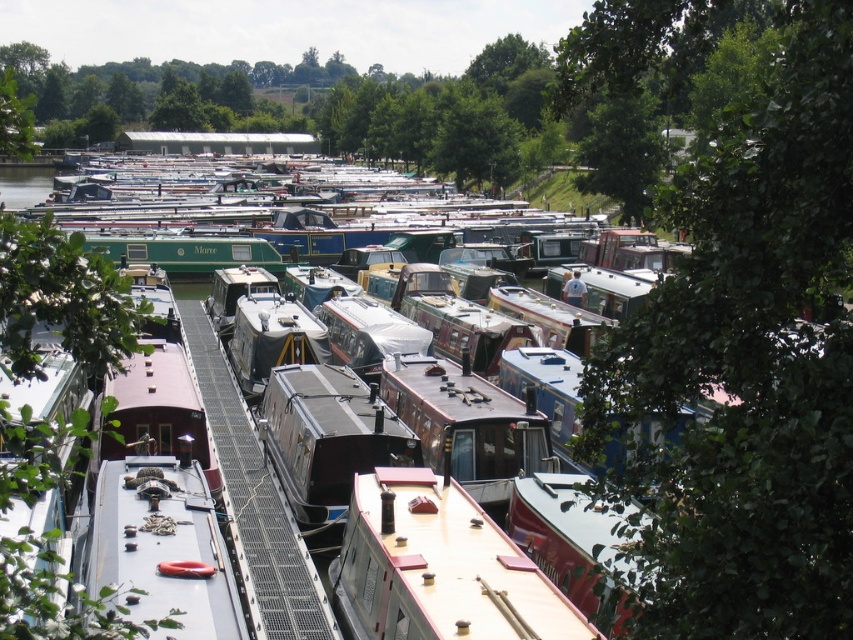
You are standing on the dock and see the white matte boat at center and the green leafy tree at upper center. Which object is closer to you?

The white matte boat at center is closer to you because it is positioned under the green leafy tree at upper center, meaning the tree is further away.

You are planning to dock your narrowboat in the marina and need to ensure it fits between the wooden boat at center and another boat on the right. Given that your boat is the same width as the green leafy tree at upper left, will it fit between them?

The wooden boat at center has a lesser width compared to the green leafy tree at upper left. Since your boat is as wide as the green leafy tree at upper left, it may not fit between the wooden boat at center and the other boat on the right unless there is sufficient space. However, the description only mentions the width comparison between the wooden boat and the tree, not the spacing between boats. Therefore, it is uncertain if there is enough room without additional information about the distance between